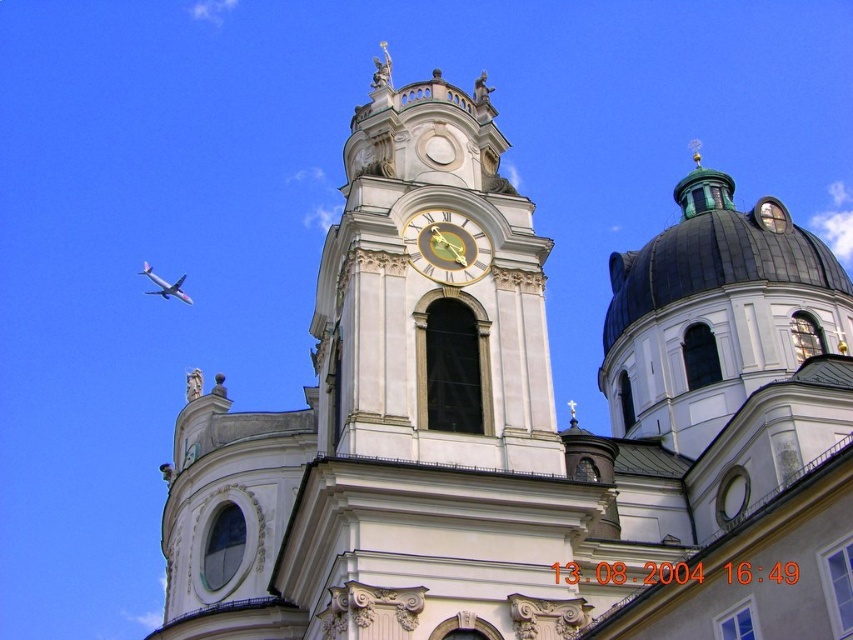
Does white stone clock tower at center have a greater width compared to metallic silver airplane at upper left?

In fact, white stone clock tower at center might be narrower than metallic silver airplane at upper left.

The image size is (853, 640). Find the location of `white stone clock tower at center`. white stone clock tower at center is located at coordinates (432, 291).

Can you confirm if white stone clock tower at center is taller than goldmetallicclock at upper center?

Indeed, white stone clock tower at center has a greater height compared to goldmetallicclock at upper center.

Is point (521, 396) more distant than point (466, 225)?

No, it is not.

Does point (428, 342) come closer to viewer compared to point (469, 241)?

Yes, point (428, 342) is in front of point (469, 241).

Identify the location of white stone clock tower at center. (432, 291).

Who is more distant from viewer, (479, 268) or (148, 275)?

The point (148, 275) is behind.

Who is more forward, (437, 230) or (181, 282)?

Point (437, 230)

Which is in front, point (430, 218) or point (173, 288)?

Positioned in front is point (430, 218).

Where is `goldmetallicclock at upper center`? goldmetallicclock at upper center is located at coordinates (445, 246).